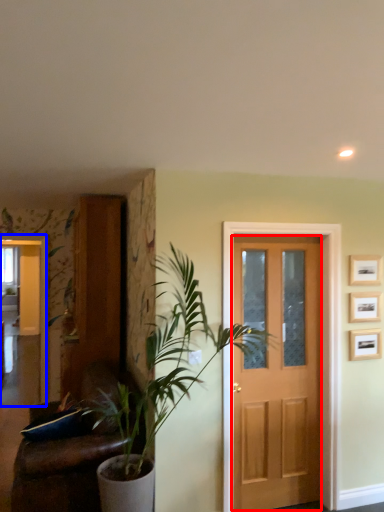
Question: Which object is further to the camera taking this photo, screen door (highlighted by a red box) or elevator (highlighted by a blue box)?

Choices:
 (A) screen door
 (B) elevator

Answer: (B)